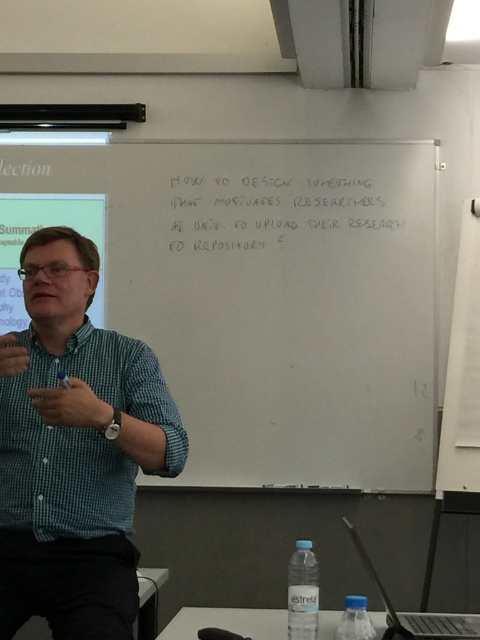
Question: Which object is positioned closest to the green checkered shirt at left?

Choices:
 (A) white handwritten text at upper center
 (B) whiteboard at upper center

Answer: (B)

Question: From the image, what is the correct spatial relationship of whiteboard at upper center in relation to green checkered shirt at left?

Choices:
 (A) right
 (B) left

Answer: (A)

Question: Which object is the farthest from the white handwritten text at upper center?

Choices:
 (A) whiteboard at upper center
 (B) green checkered shirt at left

Answer: (B)

Question: Observing the image, what is the correct spatial positioning of whiteboard at upper center in reference to white handwritten text at upper center?

Choices:
 (A) right
 (B) left

Answer: (B)

Question: Which point is farther to the camera?

Choices:
 (A) (261, 198)
 (B) (119, 401)
 (C) (278, 374)

Answer: (A)

Question: Can you confirm if whiteboard at upper center is positioned to the left of white handwritten text at upper center?

Choices:
 (A) no
 (B) yes

Answer: (B)